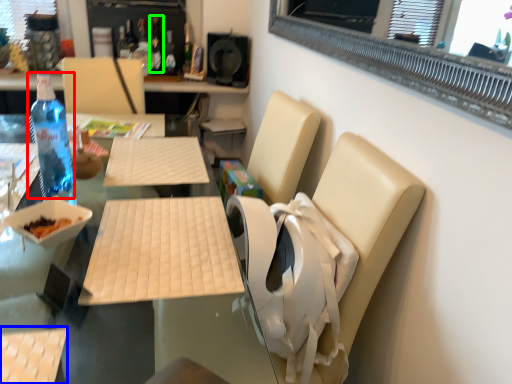
Question: Which object is the farthest from bottle (highlighted by a red box)? Choose among these: armchair (highlighted by a blue box) or bottle (highlighted by a green box).

Choices:
 (A) armchair
 (B) bottle

Answer: (B)